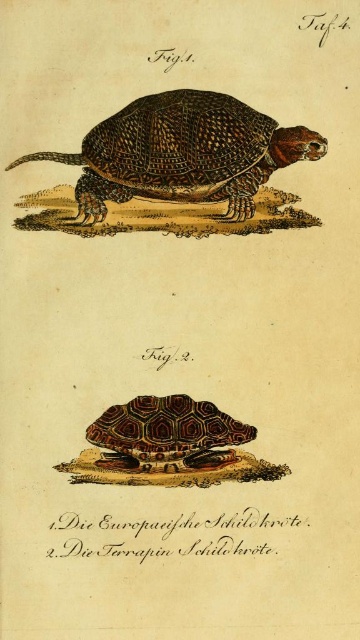
Which is below, brown textured shell at center or leopard-patterned shell at center?

leopard-patterned shell at center is lower down.

Which is more to the right, brown textured shell at center or leopard-patterned shell at center?

leopard-patterned shell at center

Does point (174, 152) come behind point (177, 422)?

Yes, point (174, 152) is behind point (177, 422).

Locate an element on the screen. This screenshot has width=360, height=640. brown textured shell at center is located at coordinates (177, 170).